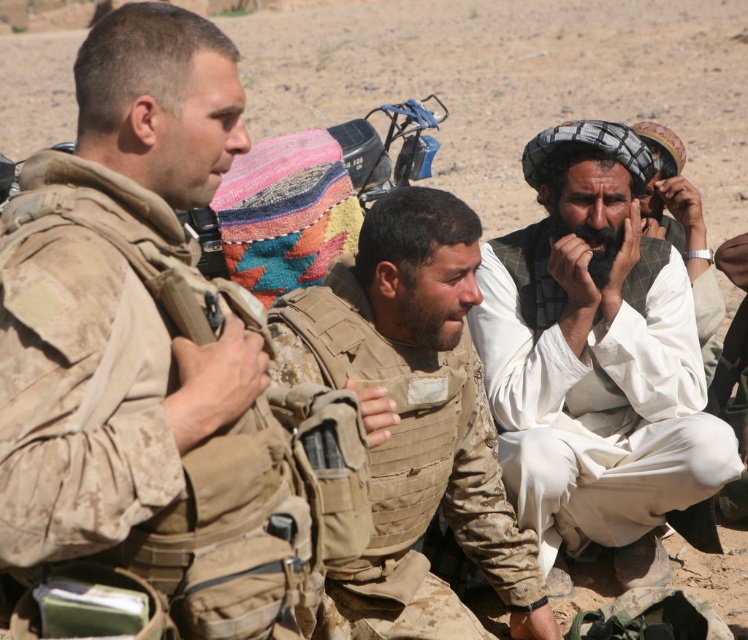
Which is in front, point (675, 397) or point (717, 310)?

Point (675, 397)

Is white cotton robe at right wider than white woven hat at upper right?

Correct, the width of white cotton robe at right exceeds that of white woven hat at upper right.

Between point (604, 417) and point (657, 156), which one is positioned in front?

Positioned in front is point (604, 417).

What are the coordinates of `white cotton robe at right` in the screenshot? It's located at (595, 358).

Is camouflage uniform at center positioned at the back of white woven hat at upper right?

No, camouflage uniform at center is closer to the viewer.

Is camouflage uniform at center smaller than white woven hat at upper right?

Incorrect, camouflage uniform at center is not smaller in size than white woven hat at upper right.

Which is behind, point (282, 301) or point (680, 205)?

The point (680, 205) is behind.

What are the coordinates of `camouflage uniform at center` in the screenshot? It's located at (416, 397).

Which is more to the left, camouflage uniform at left or white cotton robe at right?

camouflage uniform at left

Which of these two, camouflage uniform at left or white cotton robe at right, stands taller?

white cotton robe at right

What do you see at coordinates (122, 301) in the screenshot? I see `camouflage uniform at left` at bounding box center [122, 301].

Find the location of a particular element. The width and height of the screenshot is (748, 640). camouflage uniform at left is located at coordinates (122, 301).